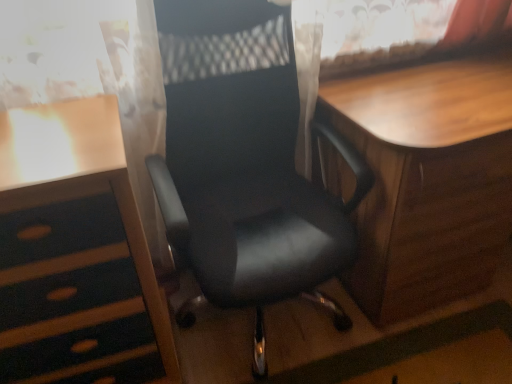
The image size is (512, 384). Describe the element at coordinates (81, 182) in the screenshot. I see `wooden desk at left` at that location.

The height and width of the screenshot is (384, 512). What are the coordinates of `black leather chair at center` in the screenshot? It's located at (245, 163).

Where is `wooden table at center`? This screenshot has width=512, height=384. wooden table at center is located at coordinates (428, 180).

Where is `wooden desk at left`? wooden desk at left is located at coordinates (81, 182).

Image resolution: width=512 pixels, height=384 pixels. I want to click on table above the wooden desk at left (from the image's perspective), so click(x=428, y=180).

Is wooden desk at left bigger than wooden table at center?

No, wooden desk at left is not bigger than wooden table at center.

From the image's perspective, which one is positioned lower, wooden desk at left or wooden table at center?

wooden desk at left.

Looking at this image, is wooden desk at left positioned with its back to wooden table at center?

No, wooden desk at left is not facing the opposite direction of wooden table at center.

At what (x,y) coordinates should I click in order to perform the action: click on chair on the left of wooden table at center. Please return your answer as a coordinate pair (x, y). Looking at the image, I should click on (245, 163).

Which of these two, wooden table at center or black leather chair at center, is bigger?

wooden table at center.

Consider the image. From the image's perspective, relative to black leather chair at center, is wooden table at center above or below?

From the image's perspective, wooden table at center appears below black leather chair at center.

Is wooden table at center not within black leather chair at center?

Absolutely, wooden table at center is external to black leather chair at center.

Who is shorter, black leather chair at center or wooden desk at left?

With less height is wooden desk at left.

Is black leather chair at center next to wooden desk at left?

black leather chair at center and wooden desk at left are not in contact.

Can you confirm if black leather chair at center is positioned to the left of wooden desk at left?

In fact, black leather chair at center is to the right of wooden desk at left.

Is black leather chair at center in front of or behind wooden desk at left in the image?

black leather chair at center is in front of wooden desk at left.

Identify the location of desk that is on the left side of black leather chair at center. The height and width of the screenshot is (384, 512). (81, 182).

From the image's perspective, is wooden desk at left located above black leather chair at center?

No, from the image's perspective, wooden desk at left is not above black leather chair at center.

Considering the points (61, 168) and (336, 251), which point is in front, point (61, 168) or point (336, 251)?

The point (61, 168) is more forward.

Can you confirm if wooden desk at left is positioned to the right of black leather chair at center?

Incorrect, wooden desk at left is not on the right side of black leather chair at center.

Considering the positions of objects black leather chair at center and wooden table at center in the image provided, who is behind, black leather chair at center or wooden table at center?

wooden table at center is further away from the camera.

Is black leather chair at center smaller than wooden table at center?

Yes, black leather chair at center is smaller than wooden table at center.

From a real-world perspective, is black leather chair at center physically located above or below wooden table at center?

From a real-world perspective, black leather chair at center is physically above wooden table at center.

Could wooden desk at left be considered to be inside wooden table at center?

No, wooden table at center does not contain wooden desk at left.

From the image's perspective, is wooden table at center under wooden desk at left?

Incorrect, from the image's perspective, wooden table at center is higher than wooden desk at left.

Are wooden table at center and wooden desk at left beside each other?

No, wooden table at center is not touching wooden desk at left.

Considering the positions of objects wooden table at center and wooden desk at left in the image provided, who is more to the left, wooden table at center or wooden desk at left?

Positioned to the left is wooden desk at left.

Identify the location of table lying behind the wooden desk at left. (428, 180).

Where is `table located underneath the black leather chair at center (from a real-world perspective)`? table located underneath the black leather chair at center (from a real-world perspective) is located at coordinates (428, 180).

Consider the image. When comparing their distances from wooden desk at left, does black leather chair at center or wooden table at center seem closer?

The object closer to wooden desk at left is black leather chair at center.

Looking at the image, which one is located closer to black leather chair at center, wooden desk at left or wooden table at center?

wooden table at center is positioned closer to the anchor black leather chair at center.

Estimate the real-world distances between objects in this image. Which object is closer to wooden table at center, black leather chair at center or wooden desk at left?

black leather chair at center is closer to wooden table at center.

When comparing their distances from black leather chair at center, does wooden table at center or wooden desk at left seem closer?

wooden table at center lies closer to black leather chair at center than the other object.

From the image, which object appears to be farther from wooden table at center, wooden desk at left or black leather chair at center?

The object further to wooden table at center is wooden desk at left.

Based on their spatial positions, is wooden table at center or black leather chair at center closer to wooden desk at left?

black leather chair at center lies closer to wooden desk at left than the other object.

Locate an element on the screen. The width and height of the screenshot is (512, 384). chair located between wooden desk at left and wooden table at center in the left-right direction is located at coordinates (245, 163).